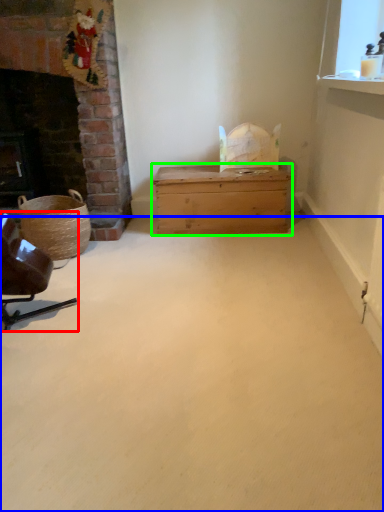
Question: Based on their relative distances, which object is nearer to chair (highlighted by a red box)? Choose from plain (highlighted by a blue box) and table (highlighted by a green box).

Choices:
 (A) plain
 (B) table

Answer: (A)